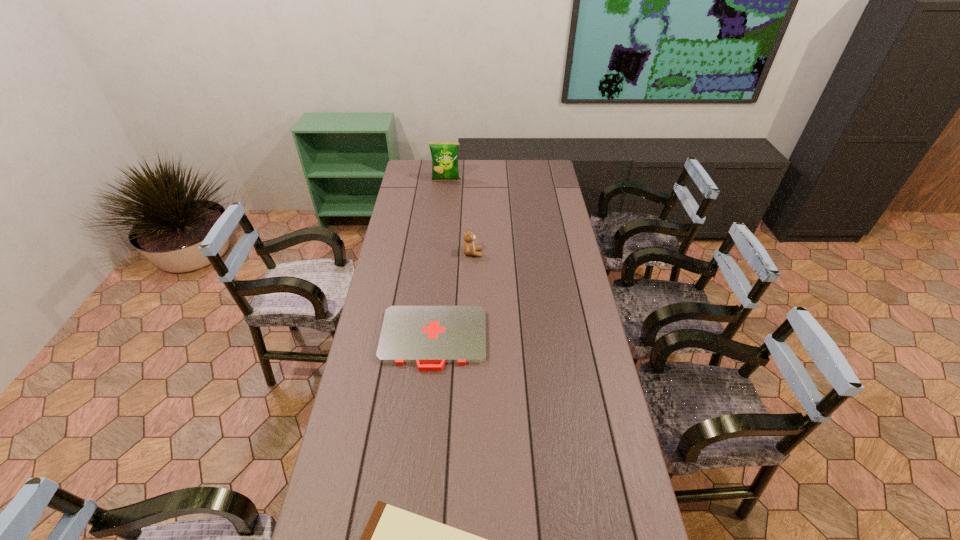
Find the location of a particular element. The height and width of the screenshot is (540, 960). the farthest object is located at coordinates (444, 155).

This screenshot has width=960, height=540. I want to click on crisp (potato chip), so click(x=444, y=155).

This screenshot has height=540, width=960. In order to click on the third shortest object in this screenshot , I will do `click(469, 248)`.

I want to click on the third nearest object, so click(x=469, y=248).

In order to click on the third tallest object in this screenshot , I will do `click(430, 336)`.

The width and height of the screenshot is (960, 540). Find the location of `the first-aid kit`. the first-aid kit is located at coordinates (430, 336).

The height and width of the screenshot is (540, 960). I want to click on vacant region located 0.160m on the front-facing side of the tallest object, so click(444, 201).

At what (x,y) coordinates should I click in order to perform the action: click on blank space located on the front-facing side of the second farthest object. Please return your answer as a coordinate pair (x, y). This screenshot has width=960, height=540. Looking at the image, I should click on (523, 253).

You are a GUI agent. You are given a task and a screenshot of the screen. Output one action in this format:
    pyautogui.click(x=<x>, y=<y>)
    Task: Click on the blank space located on handle side the third tallest object
    This screenshot has width=960, height=540.
    Given the screenshot: What is the action you would take?
    pyautogui.click(x=426, y=414)

Locate an element on the screen. Image resolution: width=960 pixels, height=540 pixels. object located in the far edge section of the desktop is located at coordinates (444, 155).